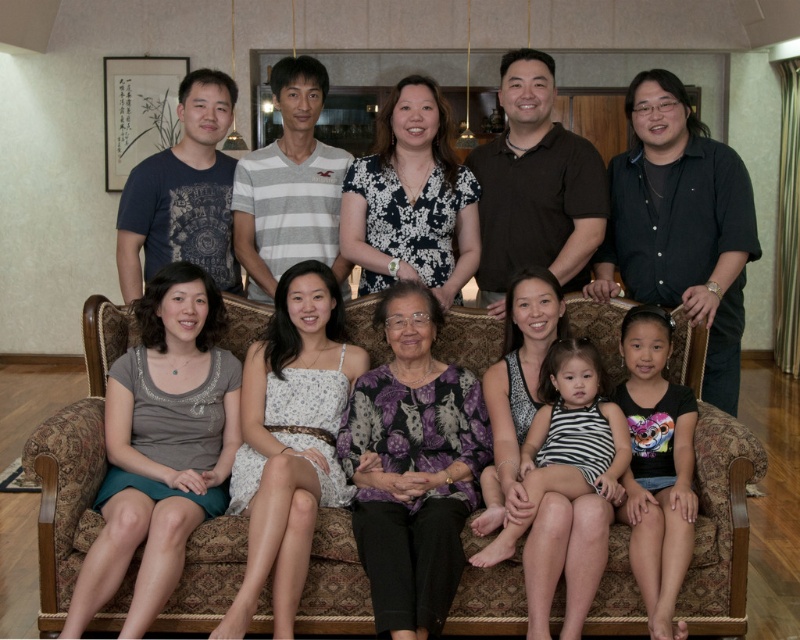
Locate an element on the screen. This screenshot has width=800, height=640. patterned fabric couch at center is located at coordinates (73, 465).

Measure the distance from patterned fabric couch at center to white floral dress at center.

The distance of patterned fabric couch at center from white floral dress at center is 17.03 inches.

Between point (706, 515) and point (256, 508), which one is positioned in front?

Positioned in front is point (256, 508).

At what (x,y) coordinates should I click in order to perform the action: click on patterned fabric couch at center. Please return your answer as a coordinate pair (x, y). Image resolution: width=800 pixels, height=640 pixels. Looking at the image, I should click on (73, 465).